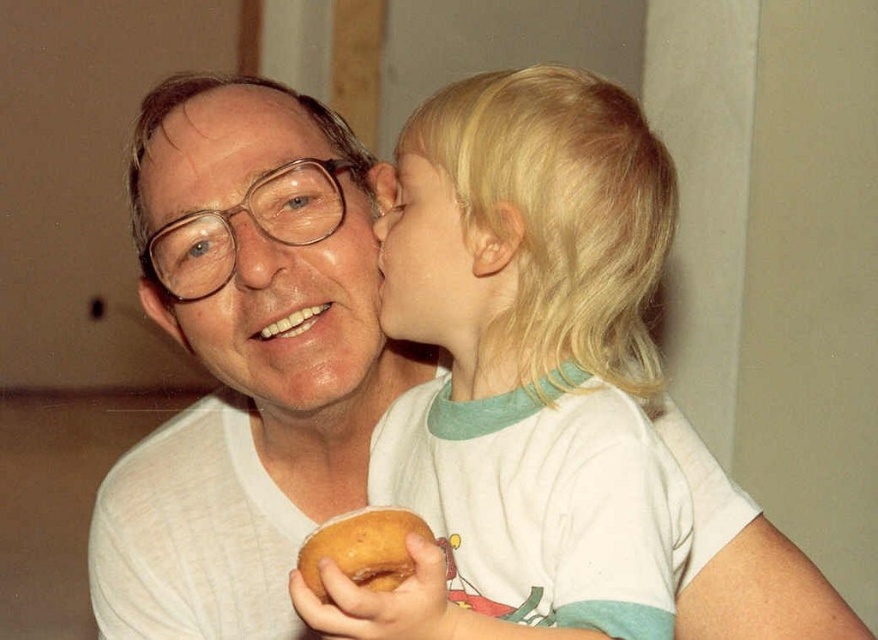
Can you confirm if matte white face at center is positioned to the right of golden brown bagel at lower center?

In fact, matte white face at center is to the left of golden brown bagel at lower center.

Between point (337, 316) and point (398, 532), which one is positioned in front?

Point (398, 532)

What do you see at coordinates (261, 246) in the screenshot? I see `matte white face at center` at bounding box center [261, 246].

The image size is (878, 640). In order to click on matte white face at center in this screenshot , I will do `click(261, 246)`.

Find the location of `matte white face at center`. matte white face at center is located at coordinates (261, 246).

Can you confirm if matte white face at center is positioned to the right of smooth skin face at center?

In fact, matte white face at center is to the left of smooth skin face at center.

The height and width of the screenshot is (640, 878). I want to click on matte white face at center, so click(261, 246).

Does blonde hair at upper center come behind matte white face at center?

That is False.

Between blonde hair at upper center and matte white face at center, which one is positioned lower?

Positioned lower is blonde hair at upper center.

Describe the element at coordinates (524, 371) in the screenshot. I see `blonde hair at upper center` at that location.

Find the location of a particular element. The height and width of the screenshot is (640, 878). blonde hair at upper center is located at coordinates (524, 371).